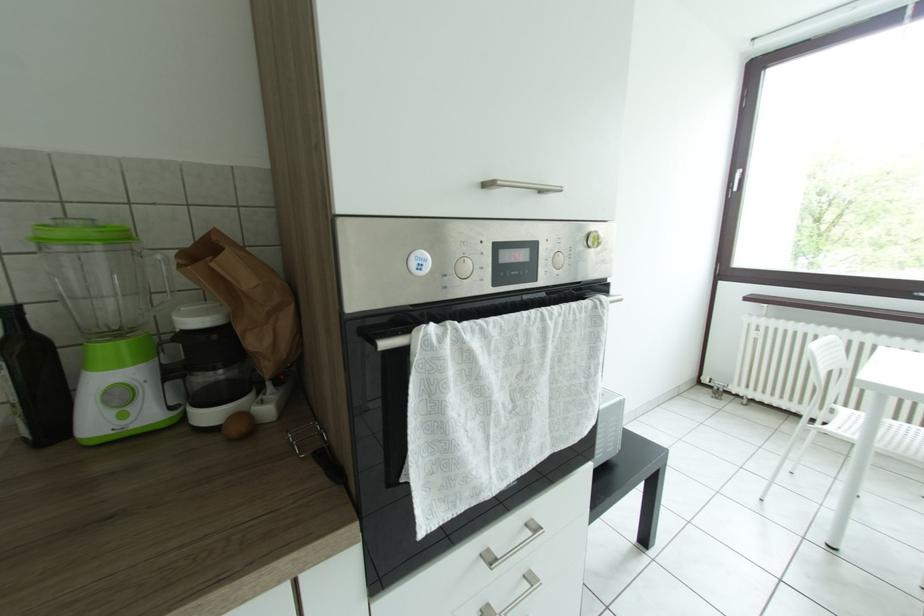
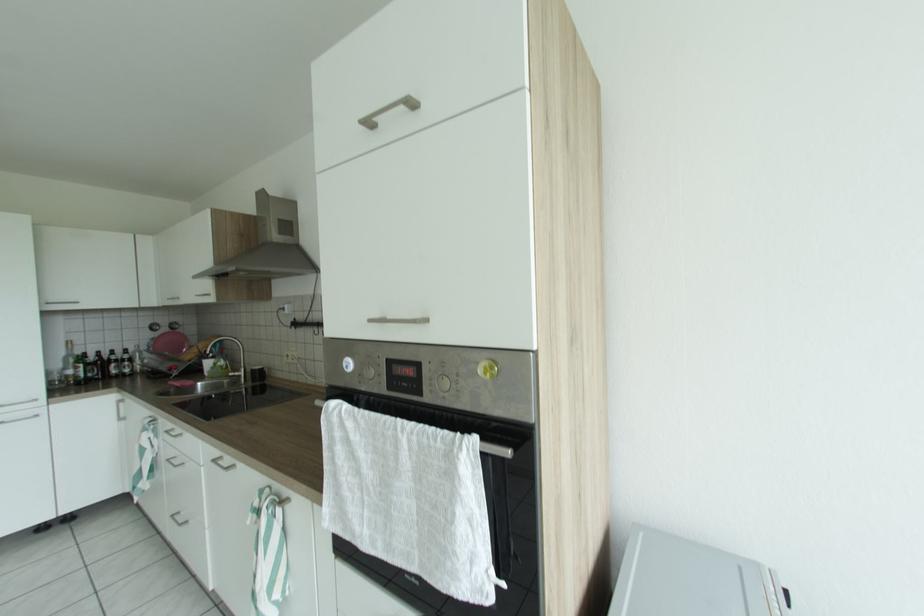
Question: The camera is either moving clockwise (left) or counter-clockwise (right) around the object. The first image is from the beginning of the video and the second image is from the end. Is the camera moving left or right when shooting the video?

Choices:
 (A) Left
 (B) Right

Answer: (B)